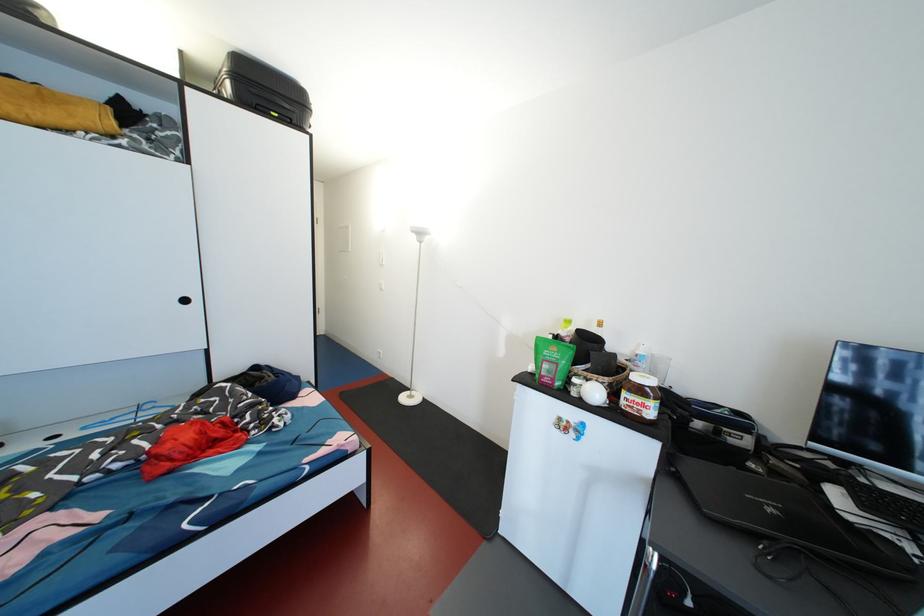
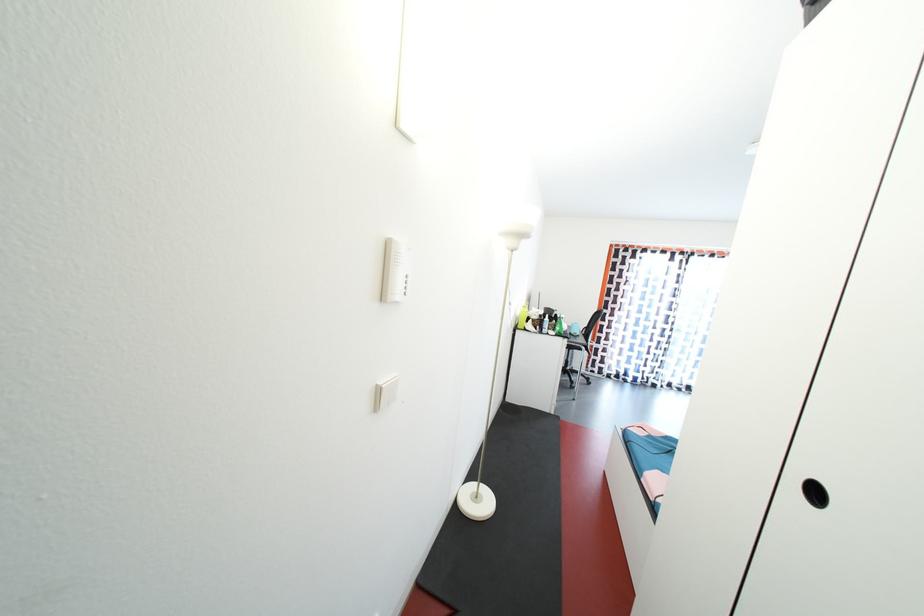
Question: I am providing you with two images of the same scene from different viewpoints. After the viewpoint changes to image2, which objects are now occluded?

Choices:
 (A) black bottle
 (B) white light switch
 (C) green food bag
 (D) digital clock

Answer: (C)